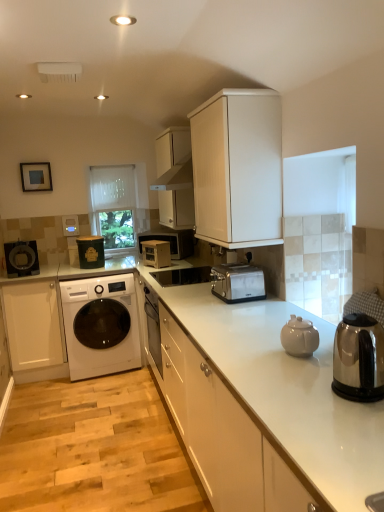
Question: Is white matte cabinet at lower left, the 4th cabinetry viewed from the right, positioned far away from stainless steel kettle at right?

Choices:
 (A) yes
 (B) no

Answer: (A)

Question: Is white matte cabinet at lower left, the 4th cabinetry viewed from the right, facing towards stainless steel kettle at right?

Choices:
 (A) no
 (B) yes

Answer: (A)

Question: Are white matte cabinet at lower left, the 4th cabinetry viewed from the right, and stainless steel kettle at right making contact?

Choices:
 (A) no
 (B) yes

Answer: (A)

Question: Is white matte cabinet at lower left, marked as the first cabinetry in a left-to-right arrangement, positioned before stainless steel kettle at right?

Choices:
 (A) yes
 (B) no

Answer: (B)

Question: Is white matte cabinet at lower left, marked as the first cabinetry in a left-to-right arrangement, to the left of stainless steel kettle at right from the viewer's perspective?

Choices:
 (A) no
 (B) yes

Answer: (B)

Question: Does white matte cabinet at lower left, the 4th cabinetry viewed from the right, contain stainless steel kettle at right?

Choices:
 (A) yes
 (B) no

Answer: (B)

Question: Considering the relative sizes of white matte cabinet at upper center, marked as the second cabinetry in a left-to-right arrangement, and satin silver toaster at center in the image provided, is white matte cabinet at upper center, marked as the second cabinetry in a left-to-right arrangement, thinner than satin silver toaster at center?

Choices:
 (A) yes
 (B) no

Answer: (B)

Question: From a real-world perspective, does white matte cabinet at upper center, which appears as the third cabinetry when viewed from the right, stand above satin silver toaster at center?

Choices:
 (A) no
 (B) yes

Answer: (B)

Question: Does white matte cabinet at upper center, marked as the second cabinetry in a left-to-right arrangement, appear on the right side of satin silver toaster at center?

Choices:
 (A) yes
 (B) no

Answer: (B)

Question: Is white matte cabinet at upper center, marked as the second cabinetry in a left-to-right arrangement, not near satin silver toaster at center?

Choices:
 (A) no
 (B) yes

Answer: (A)

Question: Can you see white matte cabinet at upper center, which appears as the third cabinetry when viewed from the right, touching satin silver toaster at center?

Choices:
 (A) yes
 (B) no

Answer: (B)

Question: Does white matte cabinet at upper center, marked as the second cabinetry in a left-to-right arrangement, have a lesser height compared to satin silver toaster at center?

Choices:
 (A) yes
 (B) no

Answer: (B)

Question: Is wooden microwave at center, the first appliance in the right-to-left sequence, positioned beyond the bounds of white matte cabinet at lower left, the 4th cabinetry viewed from the right?

Choices:
 (A) yes
 (B) no

Answer: (A)